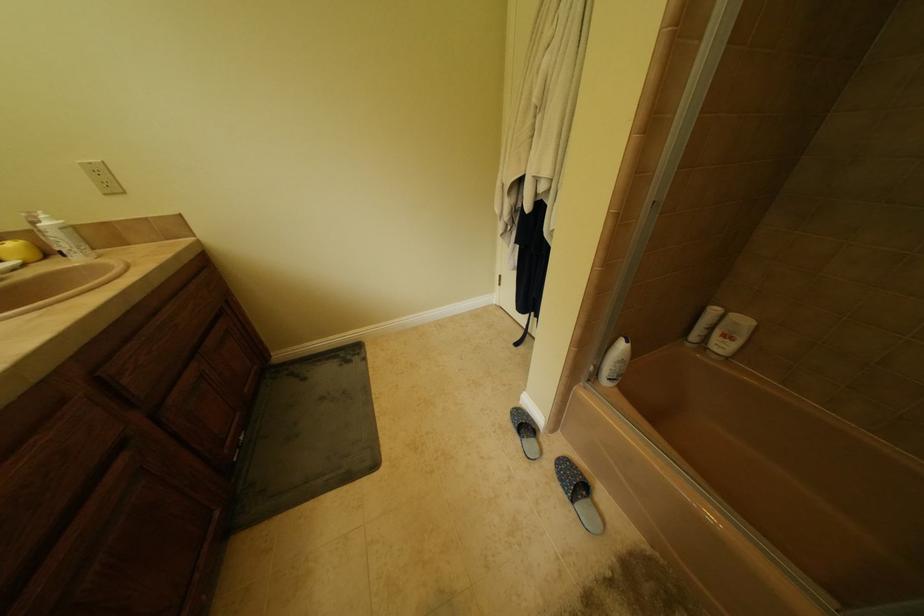
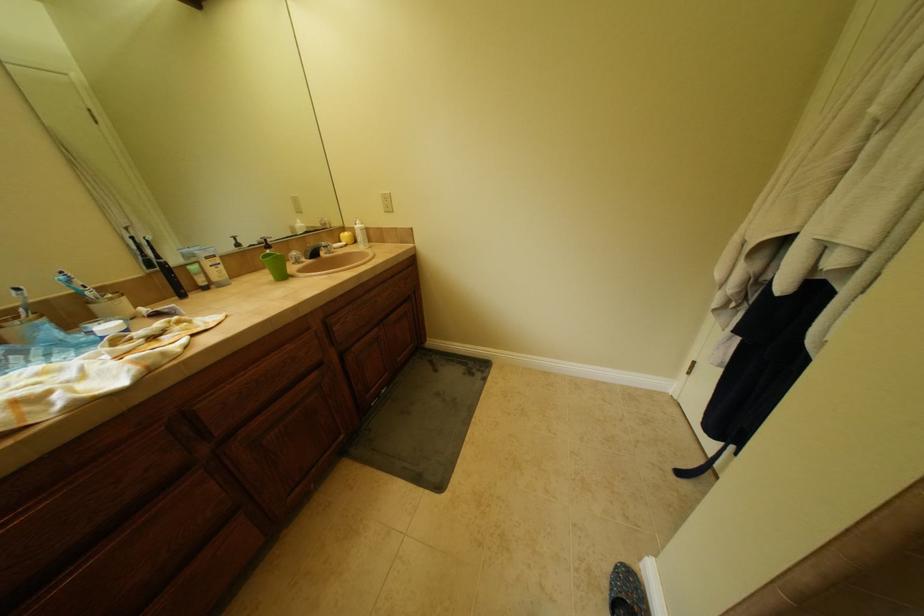
Question: The images are taken continuously from a first-person perspective. In which direction is your viewpoint rotating?

Choices:
 (A) Left
 (B) Right
 (C) Up
 (D) Down

Answer: (A)